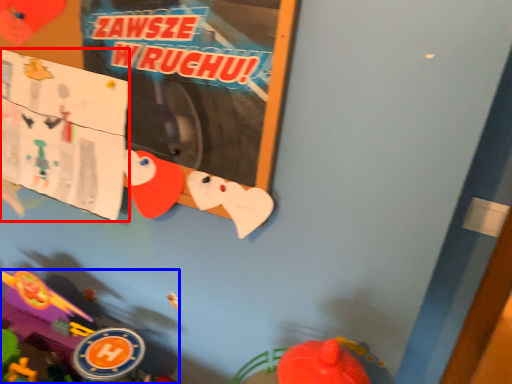
Question: Which object is closer to the camera taking this photo, poster page (highlighted by a red box) or toy (highlighted by a blue box)?

Choices:
 (A) poster page
 (B) toy

Answer: (B)